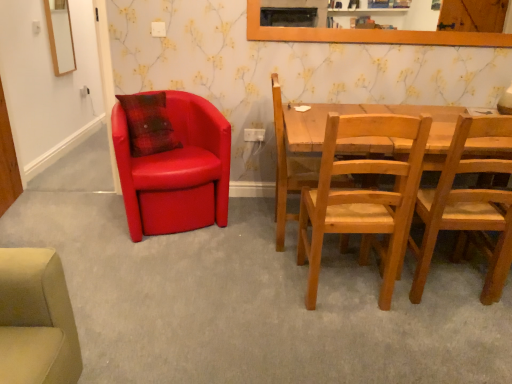
The height and width of the screenshot is (384, 512). Find the location of `vacant space underneath light brown wooden chair at right, the fourth chair from the left (from a real-world perspective)`. vacant space underneath light brown wooden chair at right, the fourth chair from the left (from a real-world perspective) is located at coordinates (453, 284).